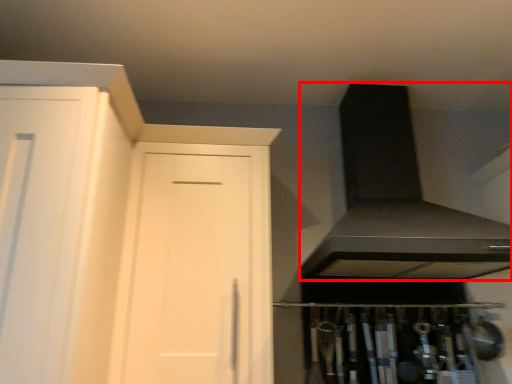
Question: Considering the relative positions of exhaust hood (annotated by the red box) and door in the image provided, where is exhaust hood (annotated by the red box) located with respect to the staircase?

Choices:
 (A) left
 (B) right

Answer: (B)